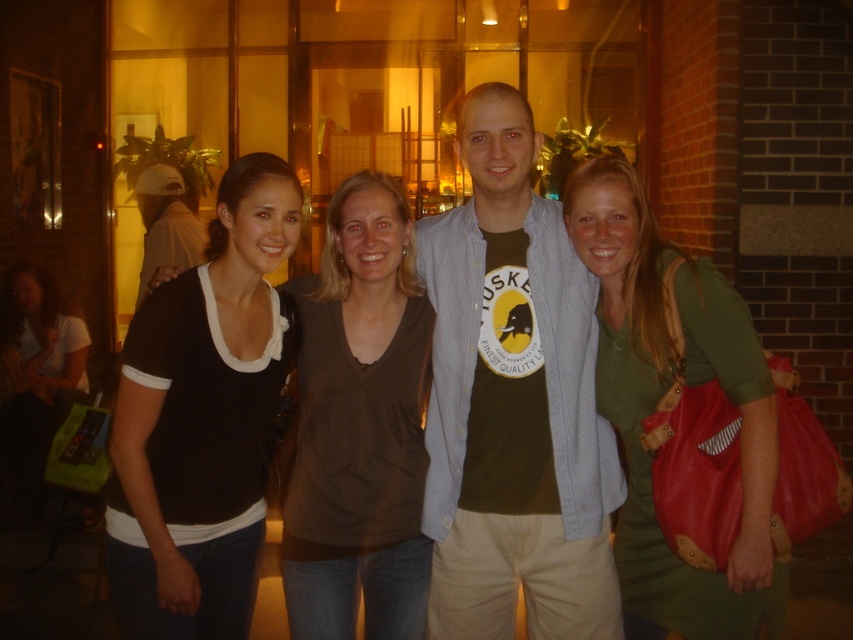
Is point (148, 563) less distant than point (618, 333)?

Yes, it is in front of point (618, 333).

Between black matte shirt at left and green fabric dress at right, which one has more height?

Standing taller between the two is green fabric dress at right.

You are a GUI agent. You are given a task and a screenshot of the screen. Output one action in this format:
    pyautogui.click(x=<x>, y=<y>)
    Task: Click on the black matte shirt at left
    The height and width of the screenshot is (640, 853).
    Given the screenshot: What is the action you would take?
    pyautogui.click(x=202, y=419)

Between matte brown t-shirt at center and matte black shirt at left, which one appears on the right side from the viewer's perspective?

From the viewer's perspective, matte brown t-shirt at center appears more on the right side.

Can you confirm if matte brown t-shirt at center is positioned above matte black shirt at left?

Actually, matte brown t-shirt at center is below matte black shirt at left.

Image resolution: width=853 pixels, height=640 pixels. Describe the element at coordinates (514, 403) in the screenshot. I see `matte brown t-shirt at center` at that location.

Where is `matte brown t-shirt at center`? matte brown t-shirt at center is located at coordinates (514, 403).

Is matte brown t-shirt at center further to the viewer compared to black cotton shirt at center?

Yes, matte brown t-shirt at center is further from the viewer.

Between matte brown t-shirt at center and black cotton shirt at center, which one is positioned higher?

matte brown t-shirt at center is above.

Identify the location of matte brown t-shirt at center. (514, 403).

This screenshot has height=640, width=853. Identify the location of matte brown t-shirt at center. (514, 403).